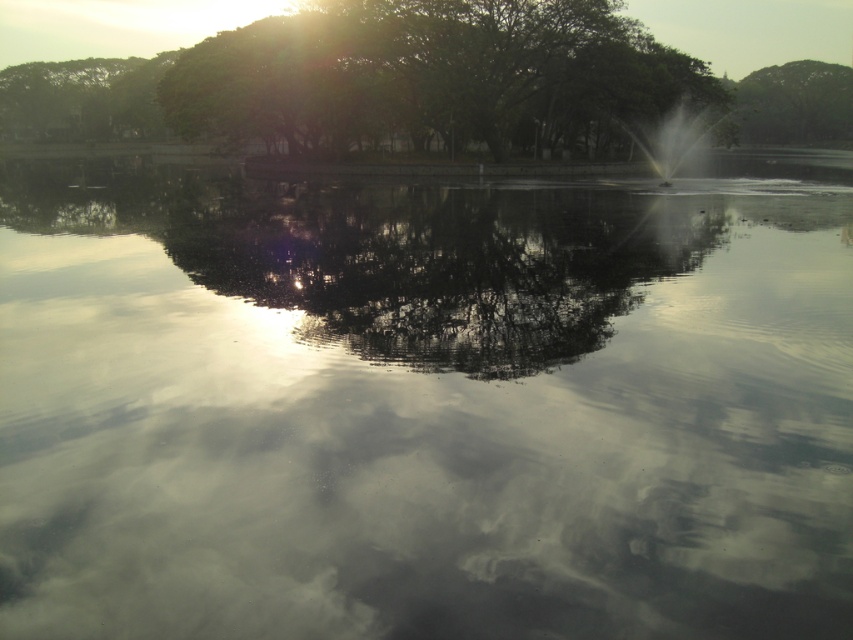
The image size is (853, 640). Describe the element at coordinates (434, 262) in the screenshot. I see `glossy reflective water at center` at that location.

Which is behind, point (231, 211) or point (616, 4)?

Point (616, 4)

Which is behind, point (146, 230) or point (692, 74)?

Positioned behind is point (692, 74).

This screenshot has width=853, height=640. Find the location of `glossy reflective water at center`. glossy reflective water at center is located at coordinates (434, 262).

Does glossy reflective water at center appear on the right side of green leafy tree at upper right?

In fact, glossy reflective water at center is to the left of green leafy tree at upper right.

Does glossy reflective water at center have a greater height compared to green leafy tree at upper right?

No.

Is point (413, 276) farther from viewer compared to point (784, 97)?

That is False.

You are a GUI agent. You are given a task and a screenshot of the screen. Output one action in this format:
    pyautogui.click(x=<x>, y=<y>)
    Task: Click on the glossy reflective water at center
    The width and height of the screenshot is (853, 640).
    Given the screenshot: What is the action you would take?
    pyautogui.click(x=434, y=262)

Which of these two, green leafy tree at upper center or green leafy tree at upper right, stands taller?

green leafy tree at upper right is taller.

Is green leafy tree at upper center above green leafy tree at upper right?

Incorrect, green leafy tree at upper center is not positioned above green leafy tree at upper right.

This screenshot has height=640, width=853. Describe the element at coordinates (433, 76) in the screenshot. I see `green leafy tree at upper center` at that location.

The image size is (853, 640). In order to click on green leafy tree at upper center in this screenshot , I will do `click(433, 76)`.